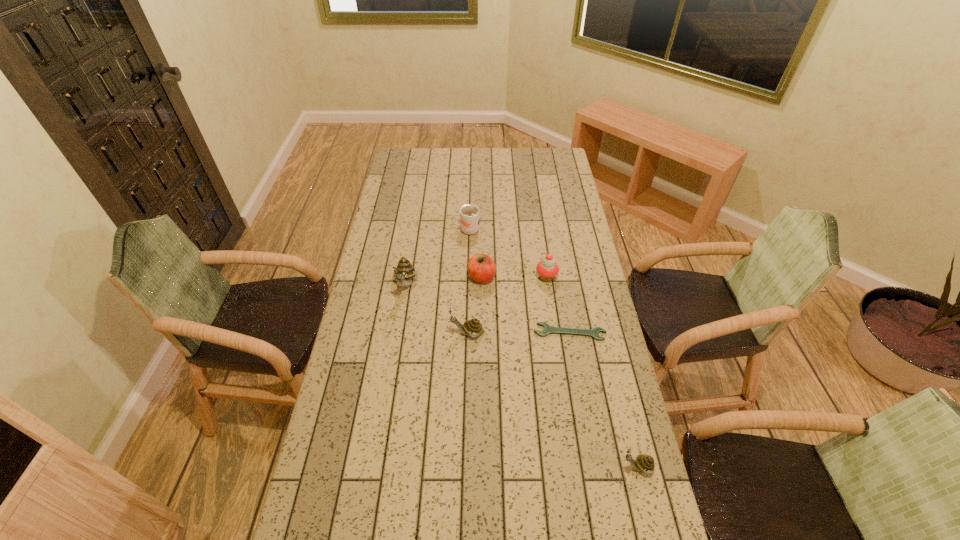
You are a GUI agent. You are given a task and a screenshot of the screen. Output one action in this format:
    pyautogui.click(x=<x>, y=<y>)
    Task: Click on the vacant space situated 0.070m on the face of the leftmost object
    
    Given the screenshot: What is the action you would take?
    pyautogui.click(x=401, y=316)

What are the coordinates of `vacant space located on the face of the second snail from left to right` in the screenshot? It's located at [427, 333].

You are a GUI agent. You are given a task and a screenshot of the screen. Output one action in this format:
    pyautogui.click(x=<x>, y=<y>)
    Task: Click on the vacant space situated on the face of the second snail from left to right
    
    Given the screenshot: What is the action you would take?
    pyautogui.click(x=350, y=333)

Locate an element on the screen. vacant space located on the face of the second snail from left to right is located at coordinates (401, 333).

The width and height of the screenshot is (960, 540). I want to click on vacant space located on the face of the rightmost snail, so click(x=598, y=467).

Find the location of `free space located 0.260m on the face of the rightmost snail`. free space located 0.260m on the face of the rightmost snail is located at coordinates (527, 467).

Locate an element on the screen. blank space located on the face of the rightmost snail is located at coordinates (580, 467).

The width and height of the screenshot is (960, 540). Find the location of `vacant space located 0.110m on the front of the cupcake`. vacant space located 0.110m on the front of the cupcake is located at coordinates (551, 306).

Where is `blank space located 0.230m on the side with the handle of the farthest object`? This screenshot has width=960, height=540. blank space located 0.230m on the side with the handle of the farthest object is located at coordinates (400, 230).

Identify the location of vacant space located 0.210m on the side with the handle of the farthest object. (404, 230).